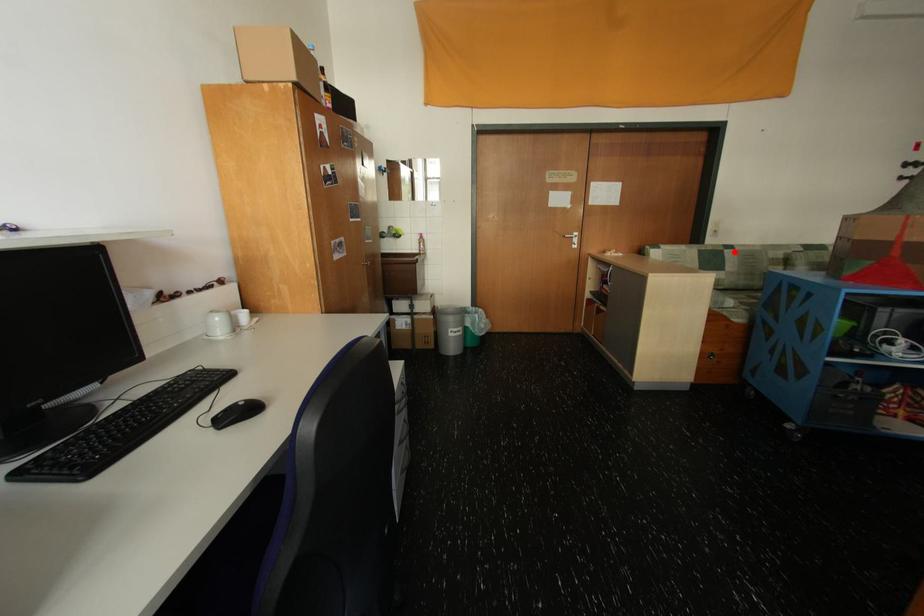
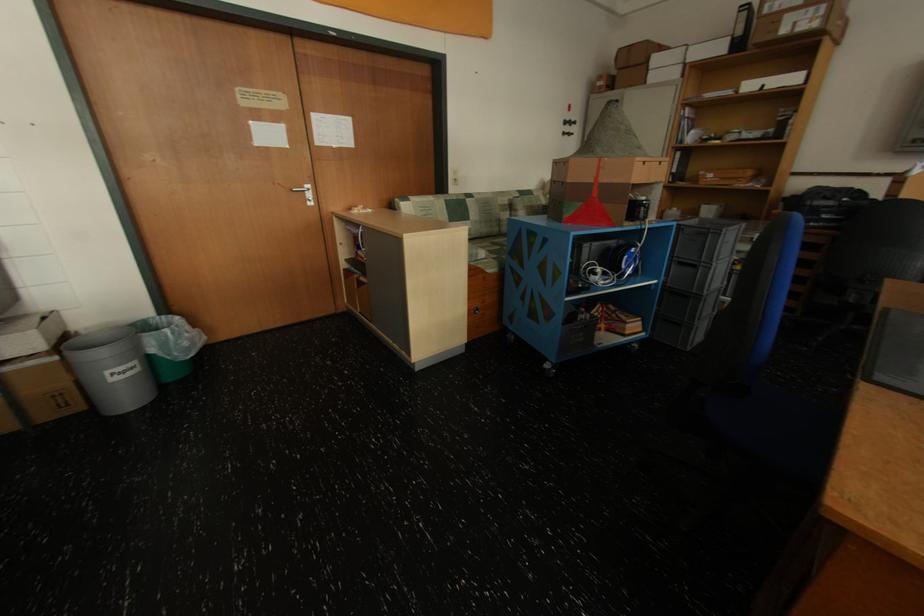
Find the pixel in the second image that matches the highlighted location in the first image.

(476, 201)